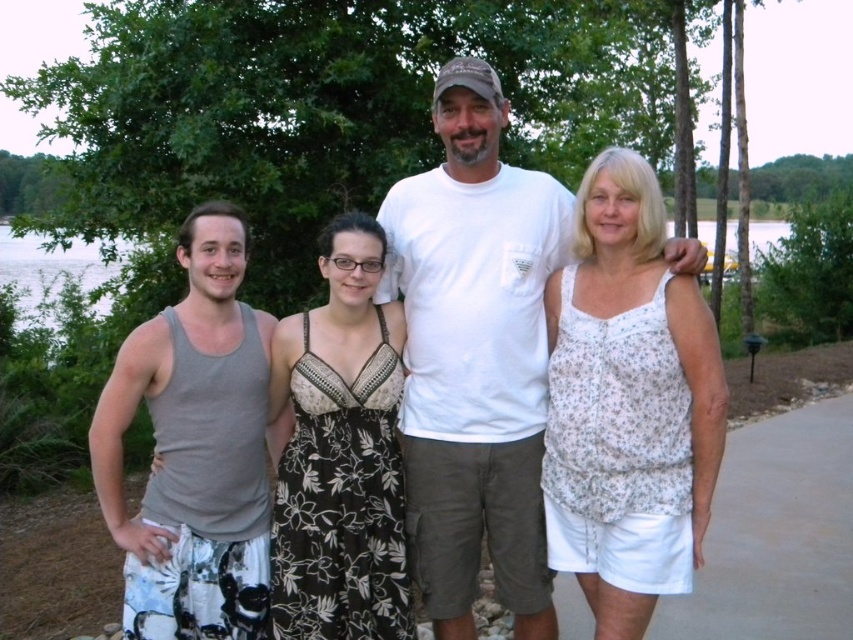
Question: Estimate the real-world distances between objects in this image. Which object is closer to the white cotton t-shirt at center?

Choices:
 (A) white floral tank top at right
 (B) gray fabric tank top at left

Answer: (A)

Question: Does white floral tank top at right appear on the left side of transparent water at left?

Choices:
 (A) no
 (B) yes

Answer: (A)

Question: Is black floral dress at center thinner than transparent water at left?

Choices:
 (A) no
 (B) yes

Answer: (B)

Question: Considering the real-world distances, which object is closest to the white cotton t-shirt at center?

Choices:
 (A) gray fabric tank top at left
 (B) white floral tank top at right
 (C) transparent water at left

Answer: (B)

Question: Which of the following is the farthest from the observer?

Choices:
 (A) (613, 412)
 (B) (397, 356)
 (C) (244, 582)

Answer: (B)

Question: Can you confirm if white cotton t-shirt at center is positioned above transparent water at left?

Choices:
 (A) no
 (B) yes

Answer: (A)